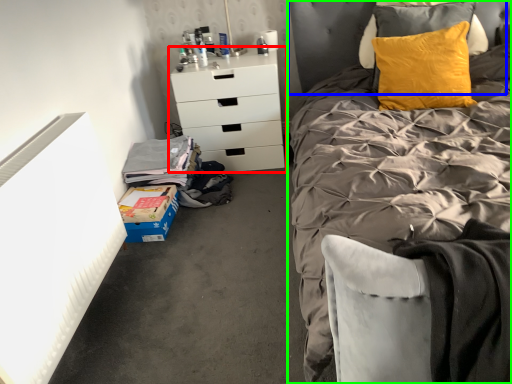
Question: Considering the real-world distances, which object is farthest from chest of drawers (highlighted by a red box)? headboard (highlighted by a blue box) or bed (highlighted by a green box)?

Choices:
 (A) headboard
 (B) bed

Answer: (B)